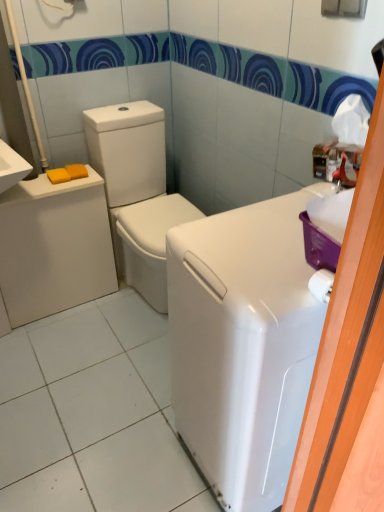
Question: Is yellow matte soap at left, positioned as the second soap in right-to-left order, smaller than white glossy washer at center?

Choices:
 (A) yes
 (B) no

Answer: (A)

Question: Can you confirm if yellow matte soap at left, positioned as the second soap in right-to-left order, is bigger than white glossy washer at center?

Choices:
 (A) yes
 (B) no

Answer: (B)

Question: Can you confirm if yellow matte soap at left, the 1th soap viewed from the left, is shorter than white glossy washer at center?

Choices:
 (A) yes
 (B) no

Answer: (A)

Question: Does yellow matte soap at left, positioned as the second soap in right-to-left order, appear on the right side of white glossy washer at center?

Choices:
 (A) no
 (B) yes

Answer: (A)

Question: Considering the relative positions of yellow matte soap at left, positioned as the second soap in right-to-left order, and white glossy washer at center in the image provided, is yellow matte soap at left, positioned as the second soap in right-to-left order, to the left of white glossy washer at center from the viewer's perspective?

Choices:
 (A) no
 (B) yes

Answer: (B)

Question: Does yellow matte soap at left, positioned as the second soap in right-to-left order, have a lesser width compared to white glossy washer at center?

Choices:
 (A) yes
 (B) no

Answer: (A)

Question: Does yellow matte soap at left, which is counted as the 2th soap, starting from the left, have a greater width compared to white glossy washer at center?

Choices:
 (A) no
 (B) yes

Answer: (A)

Question: Can you confirm if yellow matte soap at left, which is counted as the 2th soap, starting from the left, is bigger than white glossy washer at center?

Choices:
 (A) yes
 (B) no

Answer: (B)

Question: Can you confirm if yellow matte soap at left, which is counted as the 2th soap, starting from the left, is positioned to the left of white glossy washer at center?

Choices:
 (A) yes
 (B) no

Answer: (A)

Question: From the image's perspective, is yellow matte soap at left, placed as the 1th soap when sorted from right to left, beneath white glossy washer at center?

Choices:
 (A) yes
 (B) no

Answer: (B)

Question: Is yellow matte soap at left, which is counted as the 2th soap, starting from the left, smaller than white glossy washer at center?

Choices:
 (A) yes
 (B) no

Answer: (A)

Question: Could you tell me if yellow matte soap at left, placed as the 1th soap when sorted from right to left, is facing white glossy washer at center?

Choices:
 (A) no
 (B) yes

Answer: (A)

Question: Is white glossy washing machine at right positioned before white glossy washer at center?

Choices:
 (A) yes
 (B) no

Answer: (A)